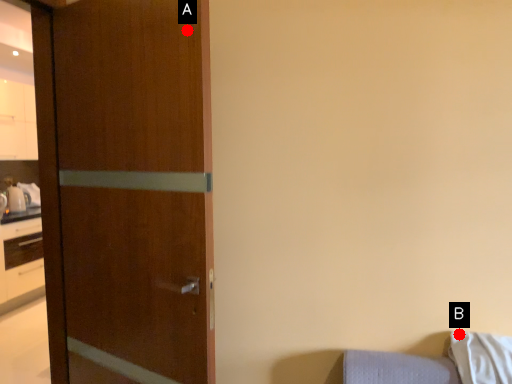
Question: Two points are circled on the image, labeled by A and B beside each circle. Among these points, which one is farthest from the camera?

Choices:
 (A) A is further
 (B) B is further

Answer: (B)